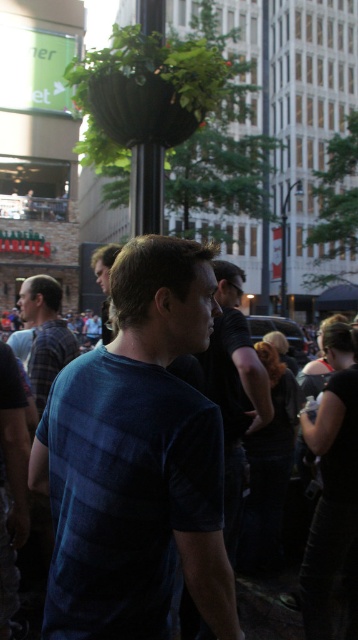
Question: Does blue striped shirt at center appear on the left side of dark blue shirt at center?

Choices:
 (A) yes
 (B) no

Answer: (A)

Question: Which point is closer to the camera?

Choices:
 (A) plaid fabric shirt at left
 (B) green matte pole at center
 (C) dark blue shirt at center
 (D) blue striped shirt at center

Answer: (D)

Question: Is dark blue shirt at center to the right of green matte pole at center from the viewer's perspective?

Choices:
 (A) yes
 (B) no

Answer: (A)

Question: Which point is farther to the camera?

Choices:
 (A) blue striped shirt at center
 (B) green matte pole at center
 (C) dark blue shirt at center

Answer: (B)

Question: Is dark blue shirt at center smaller than green matte pole at center?

Choices:
 (A) yes
 (B) no

Answer: (B)

Question: Which point is farther from the camera taking this photo?

Choices:
 (A) (150, 220)
 (B) (221, 371)

Answer: (A)